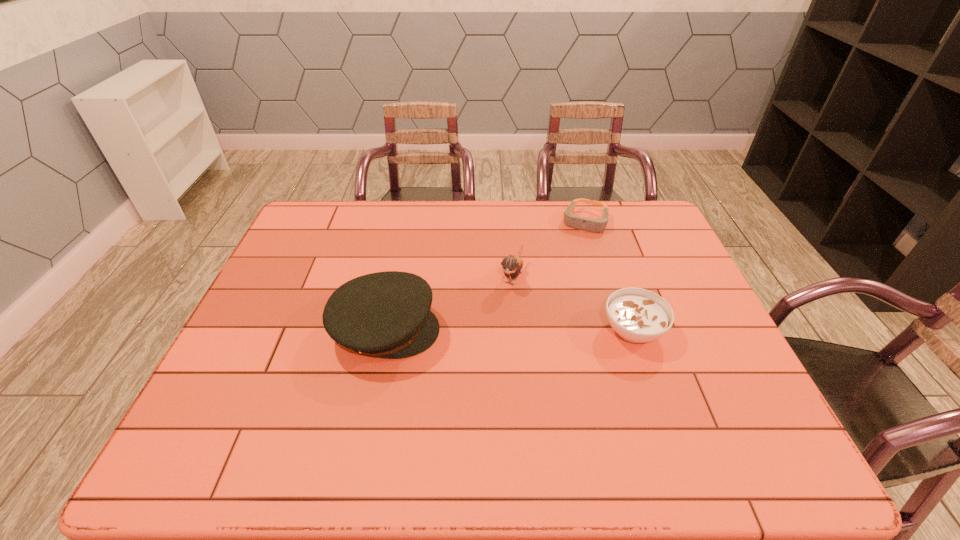
The width and height of the screenshot is (960, 540). What are the coordinates of `beret` in the screenshot? It's located at coord(387,314).

Locate an element on the screen. the tallest object is located at coordinates (387, 314).

Image resolution: width=960 pixels, height=540 pixels. I want to click on soup bowl, so click(638, 315).

Where is `the second farthest object`? This screenshot has height=540, width=960. the second farthest object is located at coordinates click(512, 265).

This screenshot has width=960, height=540. Find the location of `kitten`. kitten is located at coordinates (512, 265).

In order to click on goggles in this screenshot , I will do `click(576, 222)`.

Where is `the farthest object`? The image size is (960, 540). the farthest object is located at coordinates (576, 222).

Where is `free space located on the front-facing side of the leftmost object`? free space located on the front-facing side of the leftmost object is located at coordinates (585, 330).

Where is `vacant space situated 0.240m on the left of the soup bowl`? vacant space situated 0.240m on the left of the soup bowl is located at coordinates (510, 330).

Locate an element on the screen. free spot located 0.060m on the front-facing side of the third shortest object is located at coordinates (501, 305).